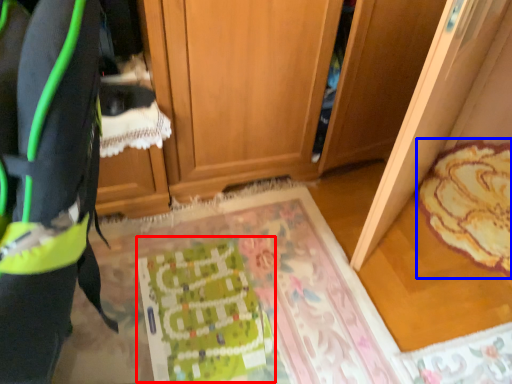
Question: Among these objects, which one is nearest to the camera, wrapping paper (highlighted by a red box) or mat (highlighted by a blue box)?

Choices:
 (A) wrapping paper
 (B) mat

Answer: (A)